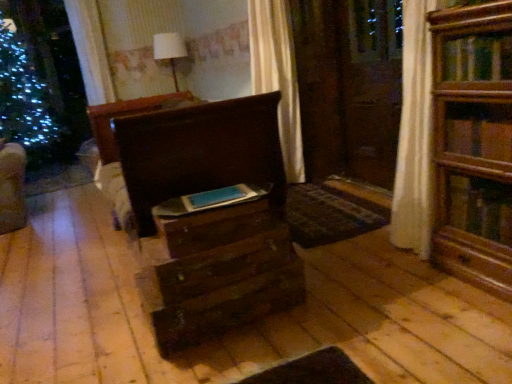
The height and width of the screenshot is (384, 512). What do you see at coordinates (201, 212) in the screenshot?
I see `dark wood chest of drawers at center` at bounding box center [201, 212].

Image resolution: width=512 pixels, height=384 pixels. Identify the location of dark wood chest of drawers at center. (201, 212).

Where is `wooden drawer at center, which is counted as the second drawer, starting from the bottom`? The image size is (512, 384). wooden drawer at center, which is counted as the second drawer, starting from the bottom is located at coordinates (216, 226).

Identify the location of matte blue book at center. This screenshot has width=512, height=384. (218, 197).

This screenshot has height=384, width=512. I want to click on wooden drawer at center, which is the first drawer from bottom to top, so click(x=221, y=272).

Is wooden drawer at center, which is counted as the second drawer, starting from the bottom, oriented towards dark wood chest of drawers at center?

No, wooden drawer at center, which is counted as the second drawer, starting from the bottom, is not oriented towards dark wood chest of drawers at center.

From the picture: Can you tell me how much wooden drawer at center, which is counted as the second drawer, starting from the bottom, and dark wood chest of drawers at center differ in facing direction?

The angular difference between wooden drawer at center, which is counted as the second drawer, starting from the bottom, and dark wood chest of drawers at center is 1.17 degrees.

Is point (223, 221) farther from viewer compared to point (250, 106)?

No, it is in front of (250, 106).

Is wooden drawer at center, which is counted as the second drawer, starting from the bottom, next to dark wood chest of drawers at center?

No, wooden drawer at center, which is counted as the second drawer, starting from the bottom, is not with dark wood chest of drawers at center.

From the image's perspective, is wooden drawer at center, the 2th drawer from the top, beneath matte blue book at center?

Yes, from the image's perspective, wooden drawer at center, the 2th drawer from the top, is below matte blue book at center.

From a real-world perspective, is wooden drawer at center, the 2th drawer from the top, physically located above or below matte blue book at center?

wooden drawer at center, the 2th drawer from the top, is situated lower than matte blue book at center in the real world.

Is the position of wooden drawer at center, which is the first drawer from bottom to top, more distant than that of matte blue book at center?

No, the depth of wooden drawer at center, which is the first drawer from bottom to top, is less than that of matte blue book at center.

Does wooden drawer at center, the 2th drawer from the top, turn towards matte blue book at center?

No, wooden drawer at center, the 2th drawer from the top, is not facing towards matte blue book at center.

Considering the sizes of objects wooden drawer at center, the 2th drawer from the top, and wooden drawer at center, which appears as the first drawer when viewed from the top, in the image provided, who is smaller, wooden drawer at center, the 2th drawer from the top, or wooden drawer at center, which appears as the first drawer when viewed from the top,?

wooden drawer at center, which appears as the first drawer when viewed from the top, is smaller.

Between wooden drawer at center, which is the first drawer from bottom to top, and wooden drawer at center, which is counted as the second drawer, starting from the bottom, which one has larger width?

With larger width is wooden drawer at center, which is the first drawer from bottom to top.

From the image's perspective, who appears lower, wooden drawer at center, which is the first drawer from bottom to top, or wooden drawer at center, which appears as the first drawer when viewed from the top?

wooden drawer at center, which is the first drawer from bottom to top, from the image's perspective.

Is point (176, 330) in front of point (266, 227)?

Yes, it is.

How different are the orientations of wooden drawer at center, which is counted as the second drawer, starting from the bottom, and wooden drawer at center, the 2th drawer from the top, in degrees?

0.912 degrees.

From the image's perspective, which one is positioned lower, wooden drawer at center, which is counted as the second drawer, starting from the bottom, or wooden drawer at center, which is the first drawer from bottom to top?

wooden drawer at center, which is the first drawer from bottom to top, is shown below in the image.

Is wooden drawer at center, which appears as the first drawer when viewed from the top, taller than wooden drawer at center, the 2th drawer from the top?

No, wooden drawer at center, which appears as the first drawer when viewed from the top, is not taller than wooden drawer at center, the 2th drawer from the top.

Which is more to the right, wooden drawer at center, which appears as the first drawer when viewed from the top, or wooden drawer at center, the 2th drawer from the top?

wooden drawer at center, the 2th drawer from the top, is more to the right.

From a real-world perspective, is dark wood chest of drawers at center located beneath matte blue book at center?

Yes, from a real-world perspective, dark wood chest of drawers at center is under matte blue book at center.

Considering the positions of points (213, 299) and (194, 211), is point (213, 299) closer to camera compared to point (194, 211)?

No, it is not.

Does dark wood chest of drawers at center have a lesser width compared to matte blue book at center?

No, dark wood chest of drawers at center is not thinner than matte blue book at center.

Which object is further away from the camera, dark wood chest of drawers at center or matte blue book at center?

matte blue book at center is further from the camera.

Is matte blue book at center not near dark wood chest of drawers at center?

No, matte blue book at center is in close proximity to dark wood chest of drawers at center.

Is matte blue book at center taller or shorter than dark wood chest of drawers at center?

In the image, matte blue book at center appears to be shorter than dark wood chest of drawers at center.

Is matte blue book at center positioned with its back to dark wood chest of drawers at center?

matte blue book at center does not have its back to dark wood chest of drawers at center.

From a real-world perspective, is dark wood chest of drawers at center over wooden drawer at center, which appears as the first drawer when viewed from the top?

Yes, from a real-world perspective, dark wood chest of drawers at center is above wooden drawer at center, which appears as the first drawer when viewed from the top.

Can you see dark wood chest of drawers at center touching wooden drawer at center, which appears as the first drawer when viewed from the top?

No, dark wood chest of drawers at center is not next to wooden drawer at center, which appears as the first drawer when viewed from the top.

Between dark wood chest of drawers at center and wooden drawer at center, which is counted as the second drawer, starting from the bottom, which one is positioned behind?

dark wood chest of drawers at center is further from the camera.

Is dark wood chest of drawers at center smaller than wooden drawer at center, which is counted as the second drawer, starting from the bottom?

Incorrect, dark wood chest of drawers at center is not smaller in size than wooden drawer at center, which is counted as the second drawer, starting from the bottom.

What are the coordinates of `chest of drawers behind the wooden drawer at center, which is counted as the second drawer, starting from the bottom` in the screenshot? It's located at (201, 212).

The image size is (512, 384). What are the coordinates of `book positioned vertically above the wooden drawer at center, which is the first drawer from bottom to top (from a real-world perspective)` in the screenshot? It's located at (218, 197).

Based on their spatial positions, is dark wood chest of drawers at center or wooden drawer at center, which appears as the first drawer when viewed from the top, closer to wooden drawer at center, the 2th drawer from the top?

Among the two, dark wood chest of drawers at center is located nearer to wooden drawer at center, the 2th drawer from the top.

Considering their positions, is matte blue book at center positioned closer to wooden drawer at center, which appears as the first drawer when viewed from the top, than dark wood chest of drawers at center?

matte blue book at center.

Looking at the image, which one is located further to wooden drawer at center, which appears as the first drawer when viewed from the top, matte blue book at center or wooden drawer at center, which is the first drawer from bottom to top?

Based on the image, wooden drawer at center, which is the first drawer from bottom to top, appears to be further to wooden drawer at center, which appears as the first drawer when viewed from the top.

Considering their positions, is wooden drawer at center, which appears as the first drawer when viewed from the top, positioned further to dark wood chest of drawers at center than wooden drawer at center, which is the first drawer from bottom to top?

wooden drawer at center, which appears as the first drawer when viewed from the top, is further to dark wood chest of drawers at center.

Considering their positions, is dark wood chest of drawers at center positioned further to wooden drawer at center, which is the first drawer from bottom to top, than matte blue book at center?

matte blue book at center is positioned further to the anchor wooden drawer at center, which is the first drawer from bottom to top.

Which object lies nearer to the anchor point dark wood chest of drawers at center, matte blue book at center or wooden drawer at center, which is the first drawer from bottom to top?

wooden drawer at center, which is the first drawer from bottom to top, lies closer to dark wood chest of drawers at center than the other object.

When comparing their distances from matte blue book at center, does dark wood chest of drawers at center or wooden drawer at center, which is the first drawer from bottom to top, seem further?

wooden drawer at center, which is the first drawer from bottom to top.

Which object lies nearer to the anchor point matte blue book at center, wooden drawer at center, which appears as the first drawer when viewed from the top, or wooden drawer at center, the 2th drawer from the top?

wooden drawer at center, which appears as the first drawer when viewed from the top.

You are a GUI agent. You are given a task and a screenshot of the screen. Output one action in this format:
    pyautogui.click(x=<x>, y=<y>)
    Task: Click on the drawer between matte blue book at center and wooden drawer at center, the 2th drawer from the top, in the vertical direction
    The image size is (512, 384).
    Given the screenshot: What is the action you would take?
    pyautogui.click(x=216, y=226)

Where is `drawer between dark wood chest of drawers at center and wooden drawer at center, the 2th drawer from the top, from top to bottom`? drawer between dark wood chest of drawers at center and wooden drawer at center, the 2th drawer from the top, from top to bottom is located at coordinates (216, 226).

Identify the location of book between dark wood chest of drawers at center and wooden drawer at center, the 2th drawer from the top, in the vertical direction. (218, 197).